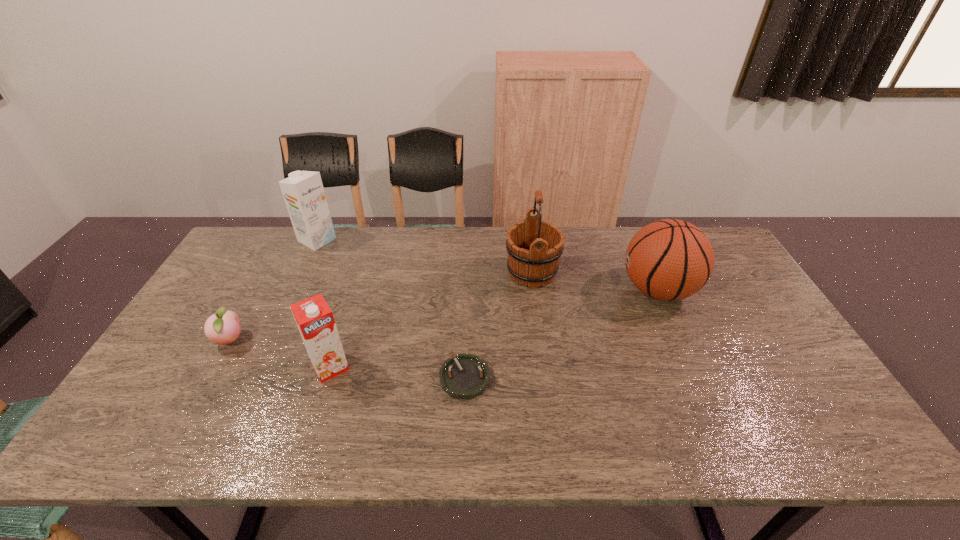
I want to click on free spot located on the front of the farther carton, so click(x=278, y=324).

You are a GUI agent. You are given a task and a screenshot of the screen. Output one action in this format:
    pyautogui.click(x=<x>, y=<y>)
    Task: Click on the vacant space situated on the side where the inflation valve is located
    
    Given the screenshot: What is the action you would take?
    pyautogui.click(x=587, y=290)

The width and height of the screenshot is (960, 540). What are the coordinates of `vacant space located 0.380m on the side where the inflation valve is located` in the screenshot? It's located at (496, 290).

You are a GUI agent. You are given a task and a screenshot of the screen. Output one action in this format:
    pyautogui.click(x=<x>, y=<y>)
    Task: Click on the free space located 0.160m on the side where the inflation valve is located
    The image size is (960, 540).
    Given the screenshot: What is the action you would take?
    click(567, 290)

Find the location of a particular element. vacant region located on the back of the third object from left to right is located at coordinates (361, 270).

Image resolution: width=960 pixels, height=540 pixels. Identify the location of vacant space located on the right of the fifth tallest object. point(342,340).

Locate an element on the screen. The height and width of the screenshot is (540, 960). vacant region located on the back of the ashtray is located at coordinates (467, 329).

Find the location of a particular element. wine bucket that is at the far edge is located at coordinates (534, 247).

Locate an element on the screen. The height and width of the screenshot is (540, 960). carton situated at the far edge is located at coordinates (303, 192).

Where is `basketball positioned at the far edge`? This screenshot has width=960, height=540. basketball positioned at the far edge is located at coordinates (670, 259).